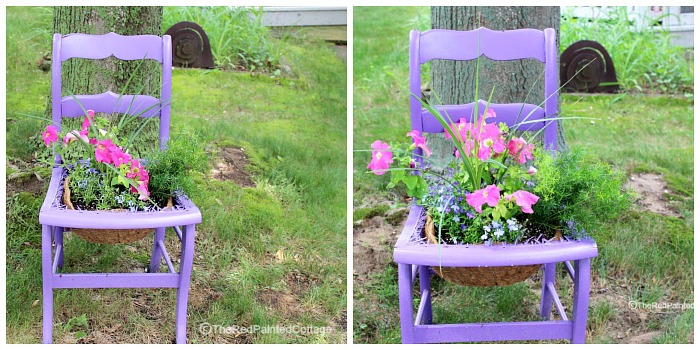
The width and height of the screenshot is (700, 350). What are the coordinates of `chair legs` in the screenshot? It's located at (46, 295), (183, 311), (155, 246), (57, 236), (425, 287), (539, 286).